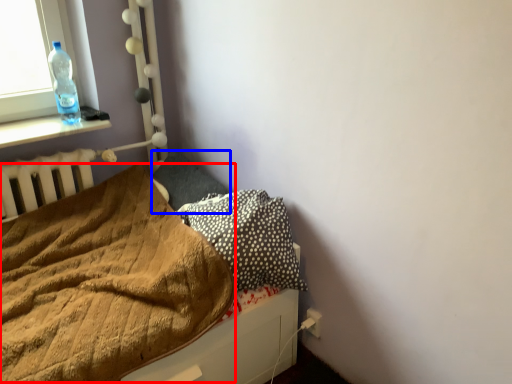
Question: Which point is further to the camera, blanket (highlighted by a red box) or pillow (highlighted by a blue box)?

Choices:
 (A) blanket
 (B) pillow

Answer: (B)